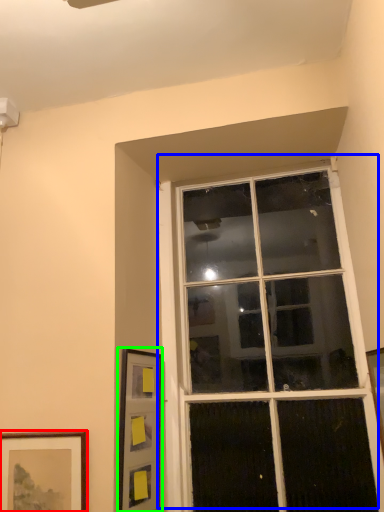
Question: Based on their relative distances, which object is farther from picture frame (highlighted by a red box)? Choose from window (highlighted by a blue box) and picture frame (highlighted by a green box).

Choices:
 (A) window
 (B) picture frame

Answer: (A)